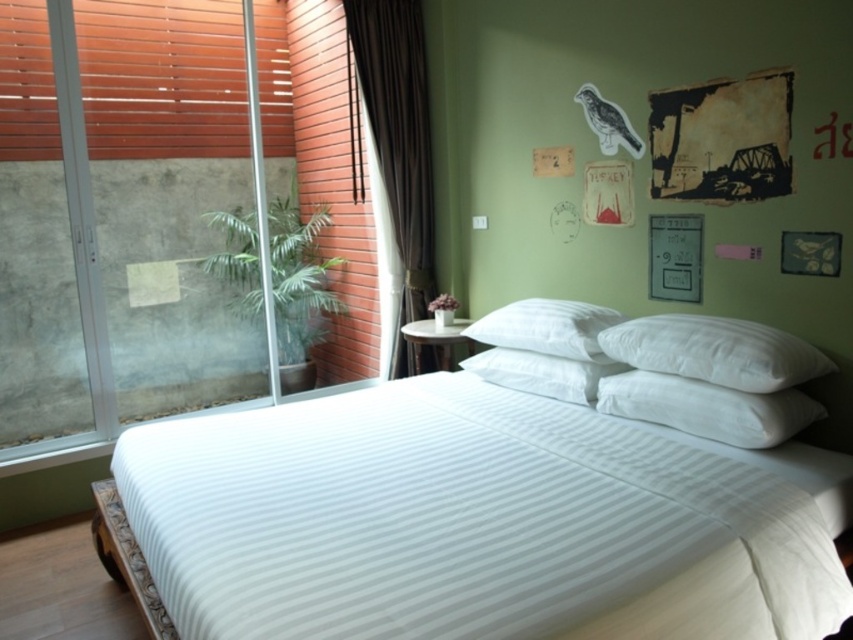
In order to click on white striped bed at center in this screenshot , I will do `click(477, 522)`.

Does point (691, 596) come closer to viewer compared to point (73, 129)?

Yes, point (691, 596) is closer to viewer.

Does point (456, 596) lie in front of point (144, 324)?

Yes, it is in front of point (144, 324).

The image size is (853, 640). I want to click on white striped bed at center, so click(x=477, y=522).

Is white striped bed at center positioned behind white soft pillow at center?

That is False.

Does white striped bed at center appear on the left side of white soft pillow at center?

Yes, white striped bed at center is to the left of white soft pillow at center.

Where is `white striped bed at center`? This screenshot has height=640, width=853. white striped bed at center is located at coordinates (477, 522).

The image size is (853, 640). Describe the element at coordinates (395, 140) in the screenshot. I see `dark brown fabric curtain at left` at that location.

Which is behind, point (368, 99) or point (677, 358)?

The point (368, 99) is behind.

Is point (410, 113) in front of point (767, 365)?

No, it is behind (767, 365).

Where is `dark brown fabric curtain at left`? dark brown fabric curtain at left is located at coordinates (395, 140).